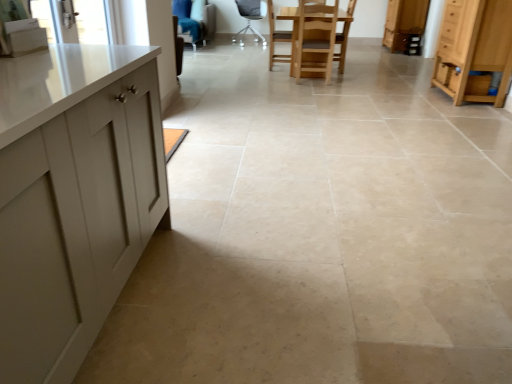
Question: Can you confirm if metallic gray chair at center, which is the first chair in back-to-front order, is wider than wooden chair at center, which is the second armchair in back-to-front order?

Choices:
 (A) yes
 (B) no

Answer: (A)

Question: Can you confirm if metallic gray chair at center, the first chair positioned from the left, is bigger than wooden chair at center, the first armchair viewed from the right?

Choices:
 (A) yes
 (B) no

Answer: (A)

Question: Does metallic gray chair at center, the first chair positioned from the left, appear on the left side of wooden chair at center, the first armchair viewed from the right?

Choices:
 (A) yes
 (B) no

Answer: (A)

Question: Considering the relative sizes of metallic gray chair at center, the second chair viewed from the front, and wooden chair at center, which is the 1th armchair from front to back, in the image provided, is metallic gray chair at center, the second chair viewed from the front, taller than wooden chair at center, which is the 1th armchair from front to back,?

Choices:
 (A) no
 (B) yes

Answer: (A)

Question: Would you say metallic gray chair at center, the second chair viewed from the front, contains wooden chair at center, the first armchair viewed from the right?

Choices:
 (A) no
 (B) yes

Answer: (A)

Question: Is metallic gray chair at center, the second chair positioned from the right, far away from wooden chair at center, the first armchair viewed from the right?

Choices:
 (A) yes
 (B) no

Answer: (A)

Question: Is metallic gray chair at center, the 2th chair when ordered from bottom to top, taller than wooden chair at center, which appears as the 2th chair when viewed from the left?

Choices:
 (A) no
 (B) yes

Answer: (B)

Question: Is the depth of metallic gray chair at center, the second chair viewed from the front, greater than that of wooden chair at center, which appears as the 2th chair when viewed from the left?

Choices:
 (A) yes
 (B) no

Answer: (A)

Question: From a real-world perspective, is metallic gray chair at center, the first chair positioned from the left, on wooden chair at center, arranged as the first chair when viewed from the front?

Choices:
 (A) yes
 (B) no

Answer: (A)

Question: Is metallic gray chair at center, the second chair positioned from the right, far away from wooden chair at center, which is the 2th chair from top to bottom?

Choices:
 (A) no
 (B) yes

Answer: (B)

Question: Is metallic gray chair at center, the second chair positioned from the right, bigger than wooden chair at center, which is the 2th chair from top to bottom?

Choices:
 (A) yes
 (B) no

Answer: (B)

Question: From the image's perspective, is metallic gray chair at center, positioned as the 1th chair in top-to-bottom order, located above wooden chair at center, arranged as the first chair when viewed from the front?

Choices:
 (A) yes
 (B) no

Answer: (A)

Question: Is light blue fabric armchair at upper center, arranged as the first armchair when viewed from the left, not within metallic gray chair at center, the first chair positioned from the left?

Choices:
 (A) yes
 (B) no

Answer: (A)